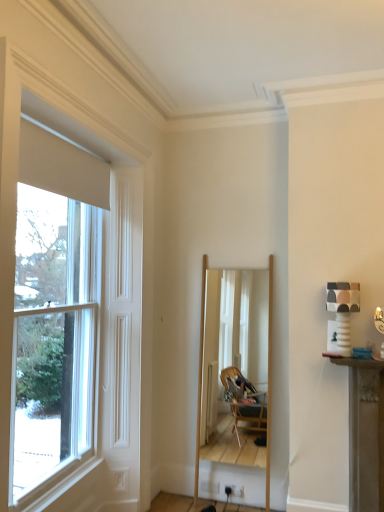
Question: Considering the positions of wooden mirror at center and white glossy window at left in the image, is wooden mirror at center wider or thinner than white glossy window at left?

Choices:
 (A) wide
 (B) thin

Answer: (A)

Question: From the image's perspective, is wooden mirror at center above or below white glossy window at left?

Choices:
 (A) above
 (B) below

Answer: (B)

Question: Is wooden mirror at center taller or shorter than white glossy window at left?

Choices:
 (A) short
 (B) tall

Answer: (A)

Question: Considering the relative positions of white glossy window at left and wooden mirror at center in the image provided, is white glossy window at left to the left or to the right of wooden mirror at center?

Choices:
 (A) left
 (B) right

Answer: (A)

Question: Looking at the image, does white glossy window at left seem bigger or smaller compared to wooden mirror at center?

Choices:
 (A) big
 (B) small

Answer: (A)

Question: Choose the correct answer: Is white glossy window at left inside wooden mirror at center or outside it?

Choices:
 (A) outside
 (B) inside

Answer: (A)

Question: Is white glossy window at left wider or thinner than wooden mirror at center?

Choices:
 (A) wide
 (B) thin

Answer: (B)